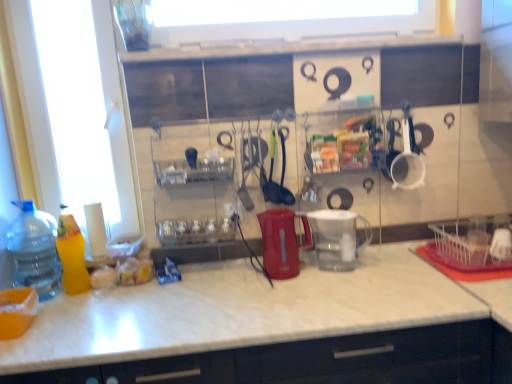
What are the coordinates of `vacant area that is in front of yellow plastic bottle at left, acting as the 1th bottle starting from the right` in the screenshot? It's located at (73, 309).